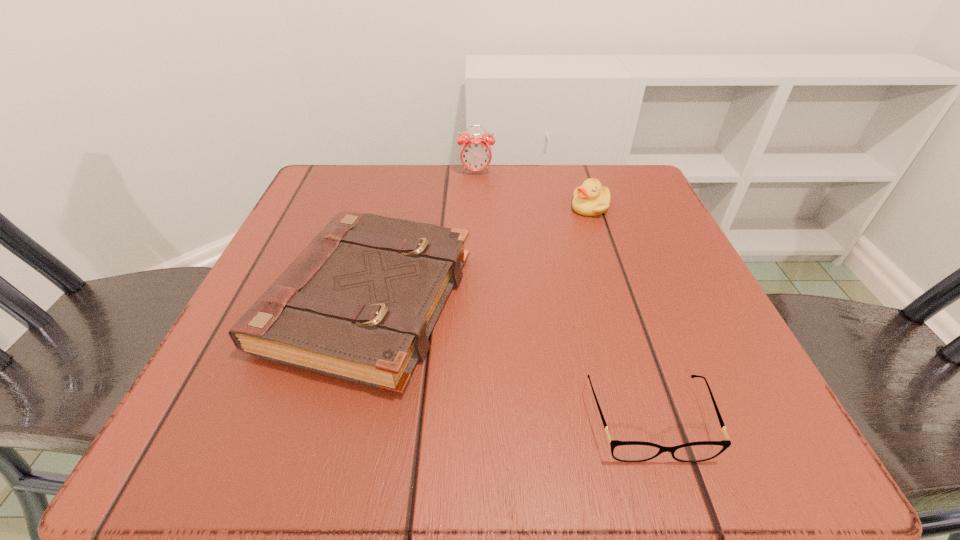
The image size is (960, 540). Find the location of `alarm clock that is at the far edge`. alarm clock that is at the far edge is located at coordinates pyautogui.click(x=475, y=153).

Identify the location of duckling that is at the far edge. The height and width of the screenshot is (540, 960). (590, 199).

Where is `hardback book that is positioned at the near edge`? The width and height of the screenshot is (960, 540). hardback book that is positioned at the near edge is located at coordinates (359, 303).

You are a GUI agent. You are given a task and a screenshot of the screen. Output one action in this format:
    pyautogui.click(x=<x>, y=<y>)
    Task: Click on the spectacles present at the near edge
    The image size is (960, 540).
    Given the screenshot: What is the action you would take?
    point(625,451)

Find the location of a particular element. object that is at the left edge is located at coordinates (359, 303).

Identify the location of duckling that is positioned at the right edge. (590, 199).

Locate an element on the screen. spectacles that is at the right edge is located at coordinates (625, 451).

Identify the location of object situated at the near left corner. The width and height of the screenshot is (960, 540). (359, 303).

The width and height of the screenshot is (960, 540). Find the location of `object positioned at the far right corner`. object positioned at the far right corner is located at coordinates (590, 199).

Find the location of a particular element. object present at the near right corner is located at coordinates (625, 451).